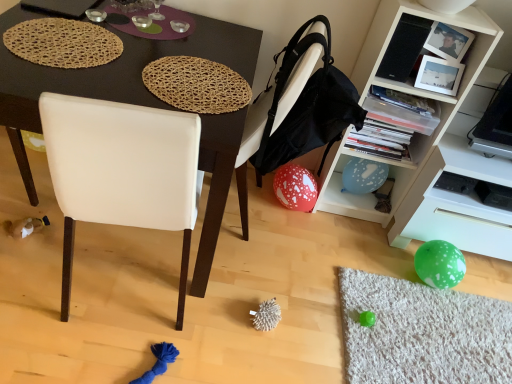
Question: Considering the positions of matte black desk at center and white plastic shelf at lower right in the image, is matte black desk at center bigger or smaller than white plastic shelf at lower right?

Choices:
 (A) big
 (B) small

Answer: (A)

Question: Considering the positions of matte black desk at center and white plastic shelf at lower right in the image, is matte black desk at center taller or shorter than white plastic shelf at lower right?

Choices:
 (A) short
 (B) tall

Answer: (B)

Question: Which is farther from the woven natural placemat at upper center, the first mat when ordered from right to left?

Choices:
 (A) white matte cabinet at upper right
 (B) white plastic shelf at lower right
 (C) red dotted balloon at lower center
 (D) brown woven placemat at upper left, arranged as the second mat when viewed from the right
 (E) white leather chair at center

Answer: (B)

Question: Estimate the real-world distances between objects in this image. Which object is farther from the woven natural placemat at upper center, the first mat when ordered from right to left?

Choices:
 (A) brown woven placemat at upper left, arranged as the second mat when viewed from the right
 (B) red dotted balloon at lower center
 (C) white matte cabinet at upper right
 (D) white plastic shelf at lower right
 (E) matte black desk at center

Answer: (D)